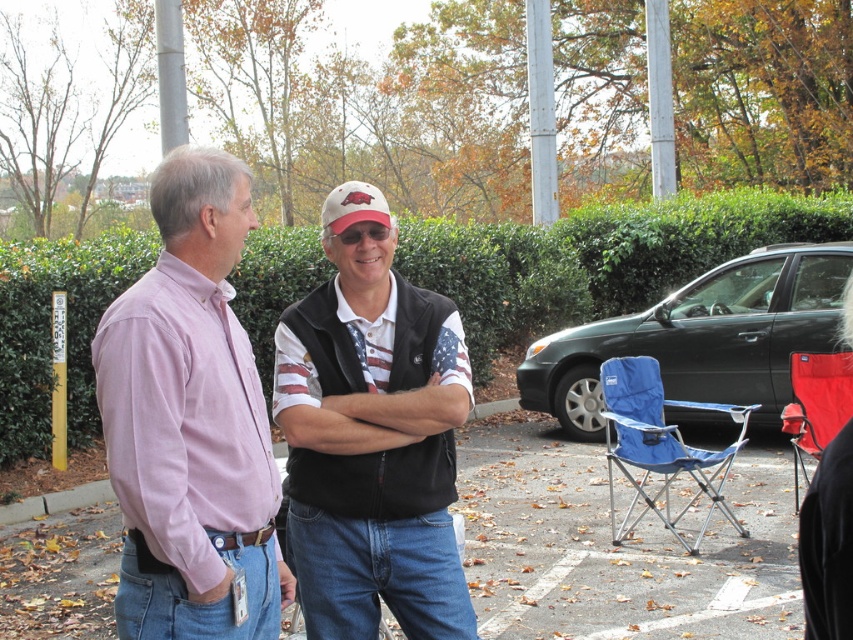
Between pink cotton shirt at center and white matte baseball cap at center, which one has more height?

With more height is pink cotton shirt at center.

Is point (233, 570) in front of point (323, 220)?

Yes, it is.

This screenshot has height=640, width=853. What are the coordinates of `pink cotton shirt at center` in the screenshot? It's located at (190, 422).

Does pink cotton shirt at center appear over dark green matte car at right?

Yes.

Does point (115, 340) come closer to viewer compared to point (846, 259)?

Yes, it is.

Where is `pink cotton shirt at center`? pink cotton shirt at center is located at coordinates (190, 422).

Where is `pink cotton shirt at center`? pink cotton shirt at center is located at coordinates (190, 422).

Does american flag fabric vest at center appear over white matte baseball cap at center?

Incorrect, american flag fabric vest at center is not positioned above white matte baseball cap at center.

Which is above, american flag fabric vest at center or white matte baseball cap at center?

white matte baseball cap at center

Image resolution: width=853 pixels, height=640 pixels. What are the coordinates of `american flag fabric vest at center` in the screenshot? It's located at (372, 445).